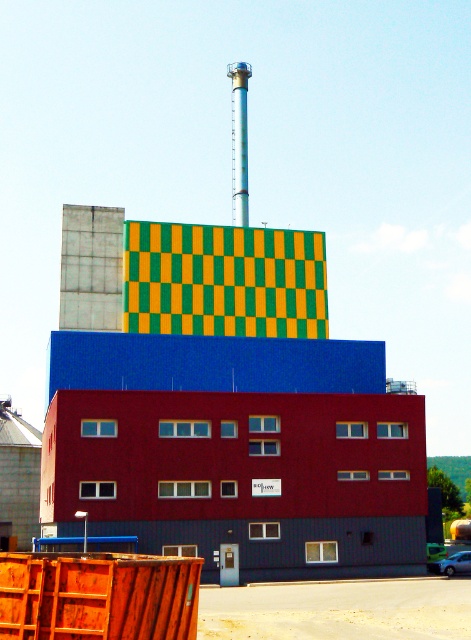
Looking at this image, you are a drone operator planning to fly a drone over the matte blue building at center and the silver metallic chimney at upper center. Since the drone has a wingspan of 1.5 meters, will it be able to pass between them without any issues?

The matte blue building at center is wider than the silver metallic chimney at upper center. Since the drone has a wingspan of 1.5 meters, it should be able to pass between them as long as the distance between them is sufficient. However, the exact feasibility depends on the specific spacing between the two structures, which isn

You are standing in front of the modern industrial building and see a point marked at coordinates (x=234, y=417). Based on the building sections described, which color section does this point belong to?

The point is on the matte blue building at center.